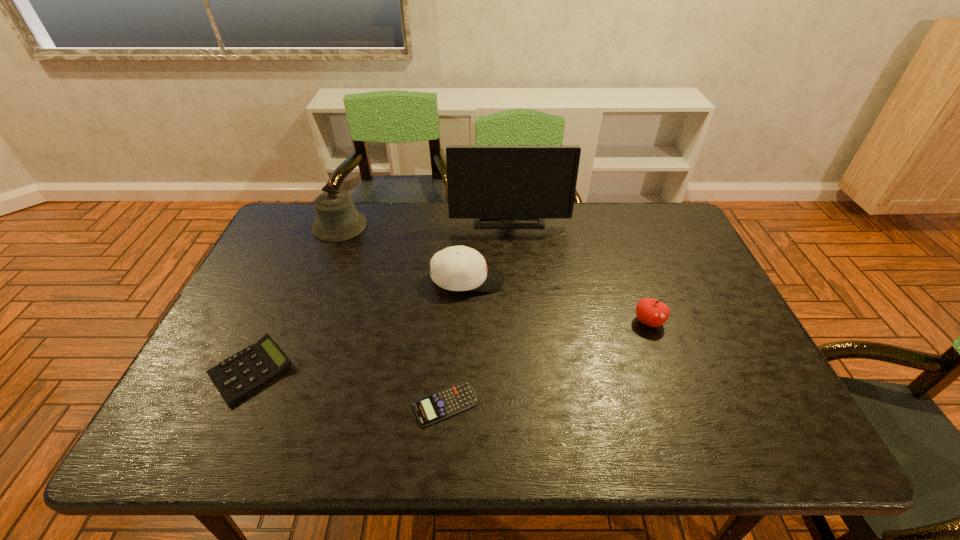
What are the coordinates of `free location located on the screen side of the tallest object` in the screenshot? It's located at (515, 292).

At what (x,y) coordinates should I click in order to perform the action: click on vacant region located 0.310m on the right of the fifth shortest object. Please return your answer as a coordinate pair (x, y). The image size is (960, 540). Looking at the image, I should click on (461, 226).

Find the location of a particular element. free space located 0.090m on the front-facing side of the third farthest object is located at coordinates (536, 280).

The image size is (960, 540). I want to click on free location located 0.170m on the front of the third nearest object, so point(674,391).

You are a GUI agent. You are given a task and a screenshot of the screen. Output one action in this format:
    pyautogui.click(x=<x>, y=<y>)
    Task: Click on the vacant space located 0.080m on the front of the taller calculator
    
    Given the screenshot: What is the action you would take?
    pyautogui.click(x=218, y=442)

The image size is (960, 540). What are the coordinates of `vacant space located on the right of the shortest object` in the screenshot? It's located at (561, 404).

At what (x,y) coordinates should I click in order to perform the action: click on computer monitor present at the far edge. Please return your answer as a coordinate pair (x, y). Looking at the image, I should click on (484, 182).

Where is `bell that is at the far edge`? bell that is at the far edge is located at coordinates (337, 219).

The width and height of the screenshot is (960, 540). Find the location of `object that is at the near edge`. object that is at the near edge is located at coordinates (447, 402).

Where is `bell present at the left edge`? Image resolution: width=960 pixels, height=540 pixels. bell present at the left edge is located at coordinates (337, 219).